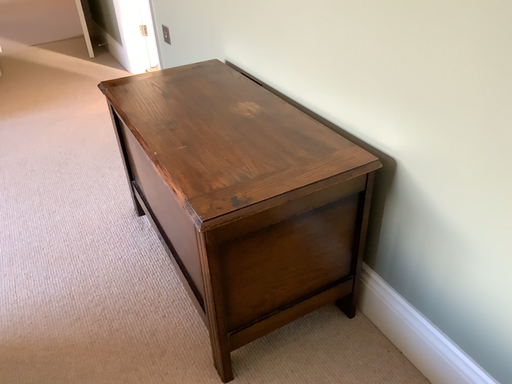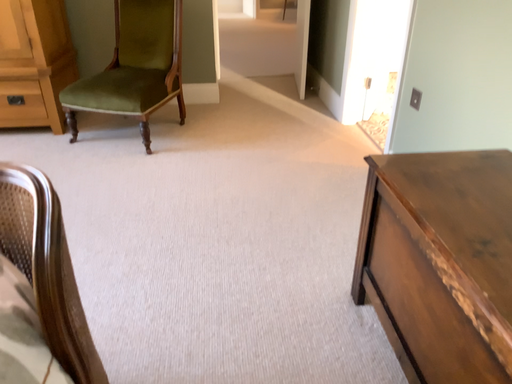
Question: How did the camera likely rotate when shooting the video?

Choices:
 (A) rotated downward
 (B) rotated upward

Answer: (B)